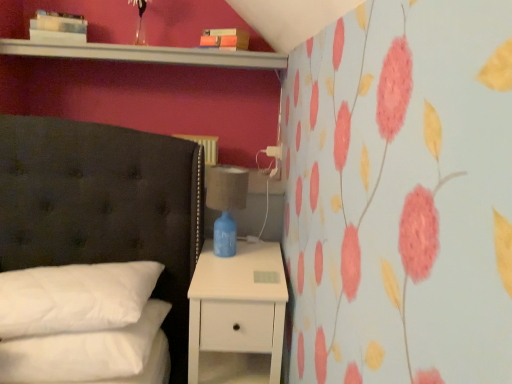
What do you see at coordinates (226, 205) in the screenshot? This screenshot has height=384, width=512. I see `blue ceramic lamp at right` at bounding box center [226, 205].

The image size is (512, 384). Describe the element at coordinates (147, 54) in the screenshot. I see `white glossy shelf at upper center` at that location.

Where is `white soft pillow at lower left, the 2th pillow when ordered from top to bottom`? The height and width of the screenshot is (384, 512). white soft pillow at lower left, the 2th pillow when ordered from top to bottom is located at coordinates (82, 351).

Find the location of `blue ceramic lamp at right`. blue ceramic lamp at right is located at coordinates (226, 205).

Find the location of a particular element. Image resolution: width=512 pixels, height=384 pixels. bedside lamp lying behind the white soft pillow at lower left, the 2th pillow when ordered from top to bottom is located at coordinates (226, 205).

From the picture: Does white soft pillow at lower left, acting as the first pillow starting from the bottom, appear on the left side of blue ceramic lamp at right?

Yes.

Does white soft pillow at lower left, the 2th pillow when ordered from top to bottom, have a lesser width compared to blue ceramic lamp at right?

No.

Does white soft pillow at lower left, the 2th pillow when ordered from top to bottom, have a smaller size compared to blue ceramic lamp at right?

No.

From a real-world perspective, is white soft pillow at lower left, the 2th pillow when ordered from top to bottom, on white glossy shelf at upper center?

No, from a real-world perspective, white soft pillow at lower left, the 2th pillow when ordered from top to bottom, is not on top of white glossy shelf at upper center.

Is white soft pillow at lower left, the 2th pillow when ordered from top to bottom, not within white glossy shelf at upper center?

white soft pillow at lower left, the 2th pillow when ordered from top to bottom, is positioned outside white glossy shelf at upper center.

Measure the distance from white soft pillow at lower left, the 2th pillow when ordered from top to bottom, to white glossy shelf at upper center.

1.21 meters.

From the image's perspective, which object appears higher, white glossy shelf at upper center or white matte nightstand at lower right?

From the image's view, white glossy shelf at upper center is above.

From a real-world perspective, between white glossy shelf at upper center and white matte nightstand at lower right, who is vertically higher?

white glossy shelf at upper center is physically above.

Is white glossy shelf at upper center located outside white matte nightstand at lower right?

white glossy shelf at upper center lies outside white matte nightstand at lower right's area.

This screenshot has height=384, width=512. What are the coordinates of `shelf above the white matte nightstand at lower right (from a real-world perspective)` in the screenshot? It's located at (147, 54).

Is blue ceramic lamp at right oriented away from white glossy shelf at upper center?

No, blue ceramic lamp at right's orientation is not away from white glossy shelf at upper center.

How many degrees apart are the facing directions of blue ceramic lamp at right and white glossy shelf at upper center?

There is a 3.65-degree angle between the facing directions of blue ceramic lamp at right and white glossy shelf at upper center.

The height and width of the screenshot is (384, 512). I want to click on bedside lamp on the right of white glossy shelf at upper center, so click(226, 205).

Does white soft pillow at lower left, the 2th pillow when ordered from top to bottom, have a smaller size compared to white soft pillow at lower left, acting as the second pillow starting from the bottom?

Indeed, white soft pillow at lower left, the 2th pillow when ordered from top to bottom, has a smaller size compared to white soft pillow at lower left, acting as the second pillow starting from the bottom.

From a real-world perspective, is white soft pillow at lower left, the 2th pillow when ordered from top to bottom, above or below white soft pillow at lower left, acting as the second pillow starting from the bottom?

In terms of real-world spatial position, white soft pillow at lower left, the 2th pillow when ordered from top to bottom, is below white soft pillow at lower left, acting as the second pillow starting from the bottom.

Considering the relative positions of white soft pillow at lower left, the 2th pillow when ordered from top to bottom, and white soft pillow at lower left, placed as the first pillow when sorted from top to bottom, in the image provided, is white soft pillow at lower left, the 2th pillow when ordered from top to bottom, to the left or to the right of white soft pillow at lower left, placed as the first pillow when sorted from top to bottom,?

white soft pillow at lower left, the 2th pillow when ordered from top to bottom, is positioned on white soft pillow at lower left, placed as the first pillow when sorted from top to bottom,'s right side.

Which of these two, white glossy shelf at upper center or white soft pillow at lower left, acting as the second pillow starting from the bottom, stands shorter?

With less height is white glossy shelf at upper center.

Could you tell me if white glossy shelf at upper center is turned towards white soft pillow at lower left, placed as the first pillow when sorted from top to bottom?

No, white glossy shelf at upper center is not facing towards white soft pillow at lower left, placed as the first pillow when sorted from top to bottom.

Starting from the white glossy shelf at upper center, which pillow is the 1st one in front? Please provide its 2D coordinates.

[(75, 297)]

In terms of height, does white matte nightstand at lower right look taller or shorter compared to white soft pillow at lower left, the 2th pillow when ordered from top to bottom?

Considering their sizes, white matte nightstand at lower right has more height than white soft pillow at lower left, the 2th pillow when ordered from top to bottom.

How different are the orientations of white matte nightstand at lower right and white soft pillow at lower left, the 2th pillow when ordered from top to bottom, in degrees?

The angular difference between white matte nightstand at lower right and white soft pillow at lower left, the 2th pillow when ordered from top to bottom, is 4.09 degrees.

In order to click on the 1st pillow to the left when counting from the white matte nightstand at lower right in this screenshot , I will do 82,351.

Are white matte nightstand at lower right and white soft pillow at lower left, the 2th pillow when ordered from top to bottom, making contact?

They are not placed beside each other.

Find the location of a particular element. the 2nd pillow below the blue ceramic lamp at right (from the image's perspective) is located at coordinates (82, 351).

From a real-world perspective, starting from the white glossy shelf at upper center, which pillow is the 2nd one below it? Please provide its 2D coordinates.

[(82, 351)]

Which object lies nearer to the anchor point white soft pillow at lower left, acting as the second pillow starting from the bottom, blue ceramic lamp at right or white glossy shelf at upper center?

blue ceramic lamp at right.

From the image, which object appears to be nearer to white soft pillow at lower left, acting as the first pillow starting from the bottom, blue ceramic lamp at right or white soft pillow at lower left, placed as the first pillow when sorted from top to bottom?

white soft pillow at lower left, placed as the first pillow when sorted from top to bottom, is closer to white soft pillow at lower left, acting as the first pillow starting from the bottom.

Based on their spatial positions, is white soft pillow at lower left, acting as the first pillow starting from the bottom, or blue ceramic lamp at right closer to white glossy shelf at upper center?

blue ceramic lamp at right is closer to white glossy shelf at upper center.

When comparing their distances from blue ceramic lamp at right, does white soft pillow at lower left, placed as the first pillow when sorted from top to bottom, or white glossy shelf at upper center seem closer?

Among the two, white soft pillow at lower left, placed as the first pillow when sorted from top to bottom, is located nearer to blue ceramic lamp at right.

Based on their spatial positions, is white glossy shelf at upper center or white soft pillow at lower left, the 2th pillow when ordered from top to bottom, closer to white matte nightstand at lower right?

The object closer to white matte nightstand at lower right is white soft pillow at lower left, the 2th pillow when ordered from top to bottom.

Based on their spatial positions, is white glossy shelf at upper center or white soft pillow at lower left, acting as the first pillow starting from the bottom, closer to white soft pillow at lower left, placed as the first pillow when sorted from top to bottom?

Among the two, white soft pillow at lower left, acting as the first pillow starting from the bottom, is located nearer to white soft pillow at lower left, placed as the first pillow when sorted from top to bottom.

Which object lies nearer to the anchor point white matte nightstand at lower right, blue ceramic lamp at right or white soft pillow at lower left, placed as the first pillow when sorted from top to bottom?

blue ceramic lamp at right.

Based on their spatial positions, is blue ceramic lamp at right or white matte nightstand at lower right closer to white soft pillow at lower left, the 2th pillow when ordered from top to bottom?

The object closer to white soft pillow at lower left, the 2th pillow when ordered from top to bottom, is white matte nightstand at lower right.

Where is `pillow between white soft pillow at lower left, placed as the first pillow when sorted from top to bottom, and blue ceramic lamp at right, in the horizontal direction`? pillow between white soft pillow at lower left, placed as the first pillow when sorted from top to bottom, and blue ceramic lamp at right, in the horizontal direction is located at coordinates (82, 351).

The height and width of the screenshot is (384, 512). I want to click on pillow between white glossy shelf at upper center and white soft pillow at lower left, the 2th pillow when ordered from top to bottom, from top to bottom, so click(x=75, y=297).

Identify the location of pillow between white soft pillow at lower left, placed as the first pillow when sorted from top to bottom, and white matte nightstand at lower right from left to right. (82, 351).

Where is `bedside lamp between white glossy shelf at upper center and white soft pillow at lower left, acting as the first pillow starting from the bottom, from top to bottom`? The image size is (512, 384). bedside lamp between white glossy shelf at upper center and white soft pillow at lower left, acting as the first pillow starting from the bottom, from top to bottom is located at coordinates [x=226, y=205].